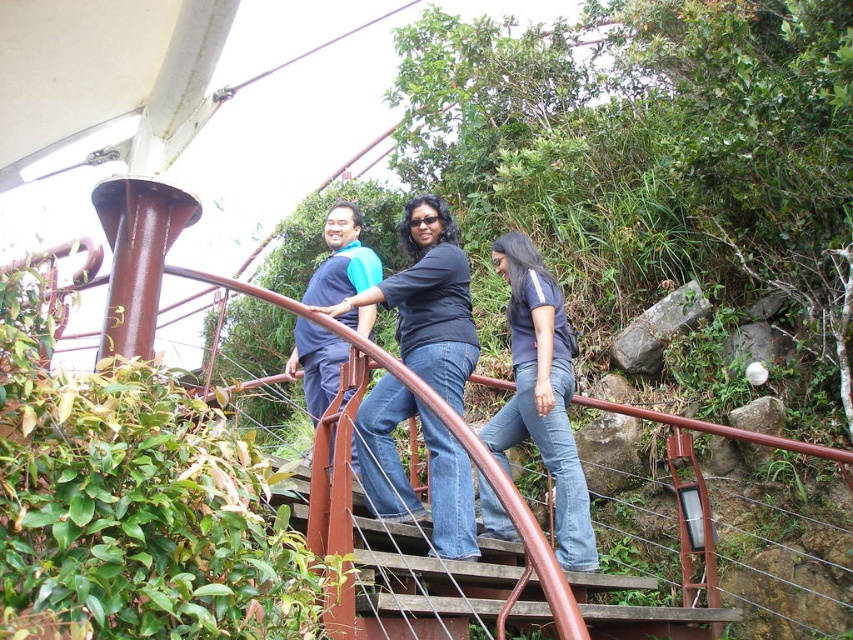
Can you confirm if dark blue shirt at center is wider than blue fabric shirt at center?

Indeed, dark blue shirt at center has a greater width compared to blue fabric shirt at center.

Between point (521, 384) and point (326, 372), which one is positioned behind?

The point (326, 372) is behind.

I want to click on dark blue shirt at center, so click(543, 394).

Between dark blue jeans at center and dark blue shirt at center, which one has less height?

With less height is dark blue jeans at center.

Between dark blue jeans at center and dark blue shirt at center, which one is positioned higher?

dark blue jeans at center

Is point (418, 236) positioned after point (553, 524)?

No, it is not.

You are a GUI agent. You are given a task and a screenshot of the screen. Output one action in this format:
    pyautogui.click(x=<x>, y=<y>)
    Task: Click on the dark blue jeans at center
    Image resolution: width=853 pixels, height=640 pixels.
    Given the screenshot: What is the action you would take?
    pyautogui.click(x=428, y=300)

Does dark blue jeans at center have a greater height compared to blue fabric shirt at center?

Yes, dark blue jeans at center is taller than blue fabric shirt at center.

Between dark blue jeans at center and blue fabric shirt at center, which one is positioned higher?

blue fabric shirt at center

Identify the location of dark blue jeans at center. (428, 300).